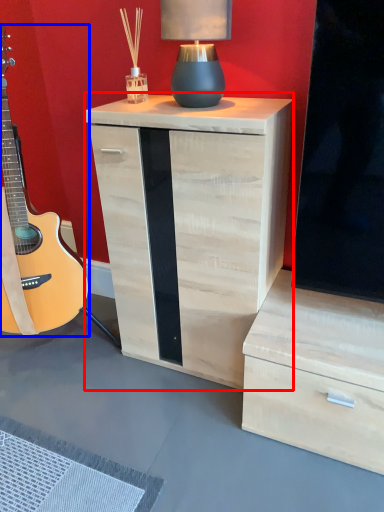
Question: Which object is further to the camera taking this photo, nightstand (highlighted by a red box) or guitar (highlighted by a blue box)?

Choices:
 (A) nightstand
 (B) guitar

Answer: (A)